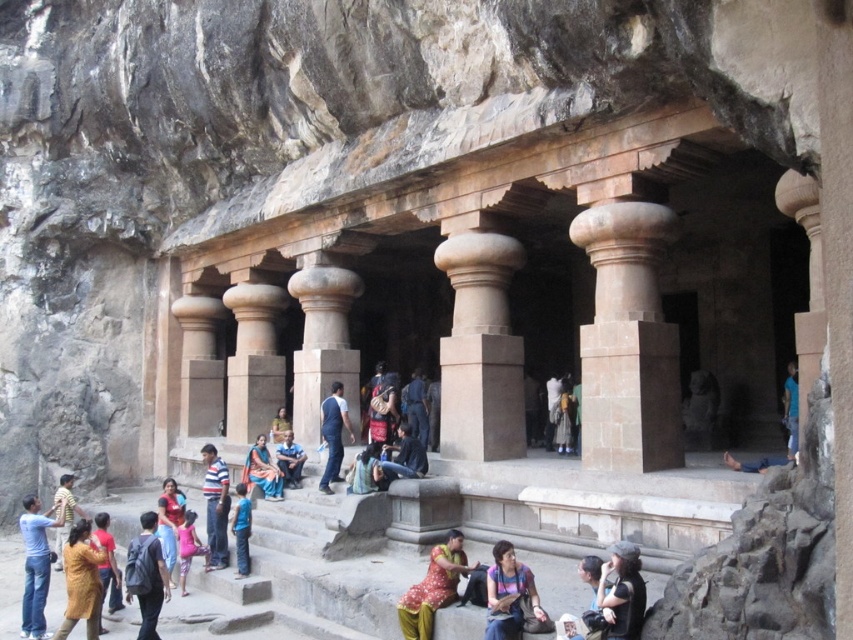
Question: Which of these objects is positioned closest to the reddish fabric bag at center?

Choices:
 (A) yellow cotton dress at lower left
 (B) smooth stone column at center
 (C) dark blue backpack at lower left

Answer: (B)

Question: Does striped polo shirt at center appear on the left side of blue denim jeans at center?

Choices:
 (A) no
 (B) yes

Answer: (B)

Question: Among these objects, which one is farthest from the camera?

Choices:
 (A) pink fabric dress at lower center
 (B) reddish fabric bag at center

Answer: (B)

Question: Is reddish fabric bag at center smaller than striped cotton shirt at lower left?

Choices:
 (A) yes
 (B) no

Answer: (A)

Question: Is the position of matte pink shirt at lower center more distant than that of blue denim jeans at center?

Choices:
 (A) yes
 (B) no

Answer: (B)

Question: Which point is farther to the camera?

Choices:
 (A) denim jeans at lower left
 (B) satin blue saree at center
 (C) brown stone column at center

Answer: (B)